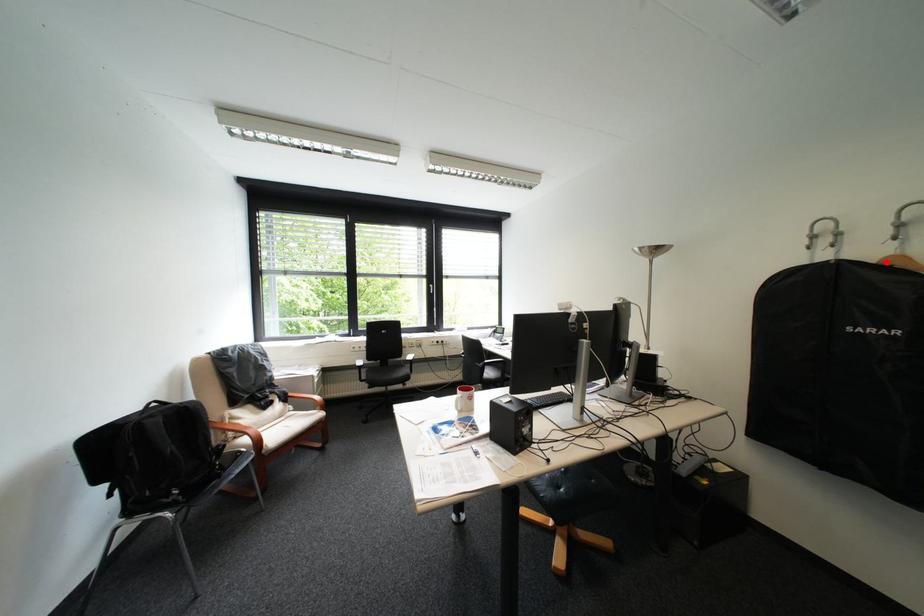
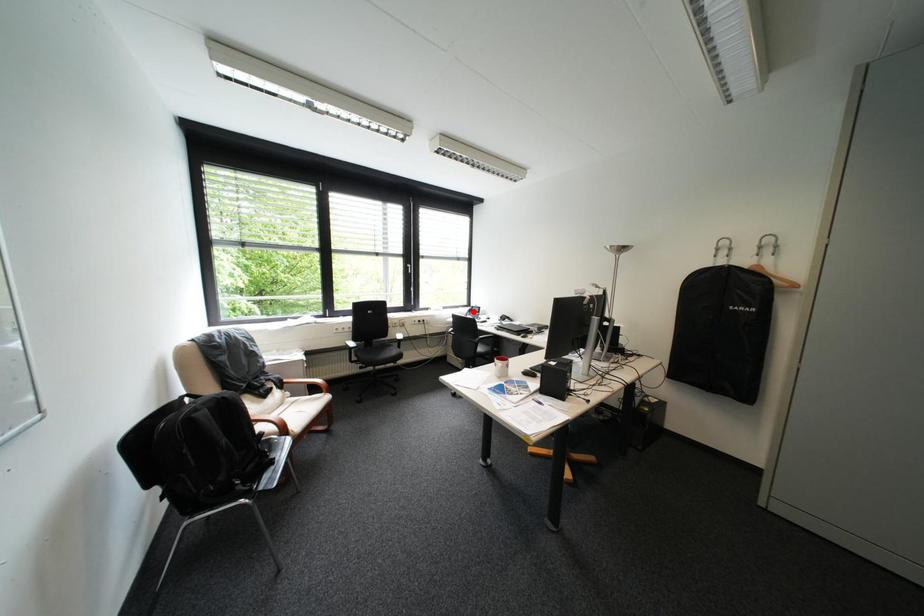
I am providing you with two images of the same scene from different viewpoints. A red point is marked on the first image and another point is marked on the second image. Is the marked point in image1 the same physical position as the marked point in image2?

No